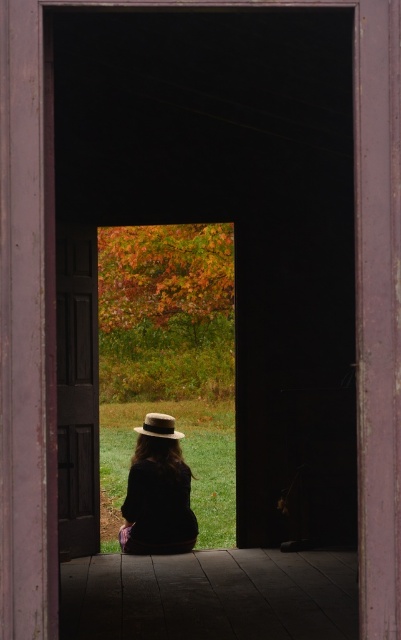
Question: Which point is farther from the camera taking this photo?

Choices:
 (A) (170, 416)
 (B) (91, 515)

Answer: (A)

Question: Which point is farther to the camera?

Choices:
 (A) (159, 493)
 (B) (68, 508)
 (C) (141, 433)

Answer: (C)

Question: Among these objects, which one is farthest from the camera?

Choices:
 (A) matte black coat at center
 (B) brown felt fedora at center

Answer: (B)

Question: Can you confirm if matte black coat at center is smaller than brown felt fedora at center?

Choices:
 (A) yes
 (B) no

Answer: (B)

Question: Is dark wood door at center wider than brown felt fedora at center?

Choices:
 (A) yes
 (B) no

Answer: (B)

Question: Can you confirm if dark wood door at center is thinner than brown felt fedora at center?

Choices:
 (A) no
 (B) yes

Answer: (B)